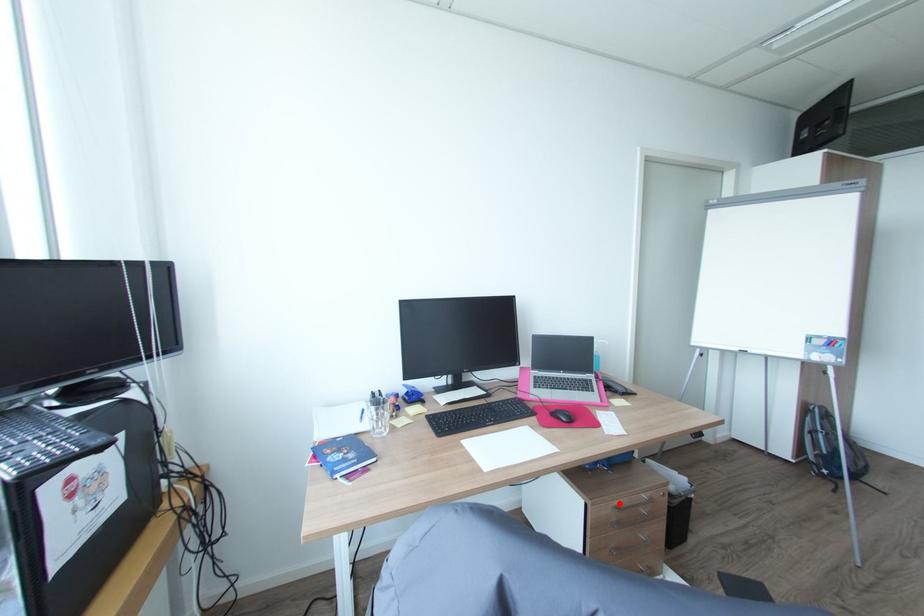
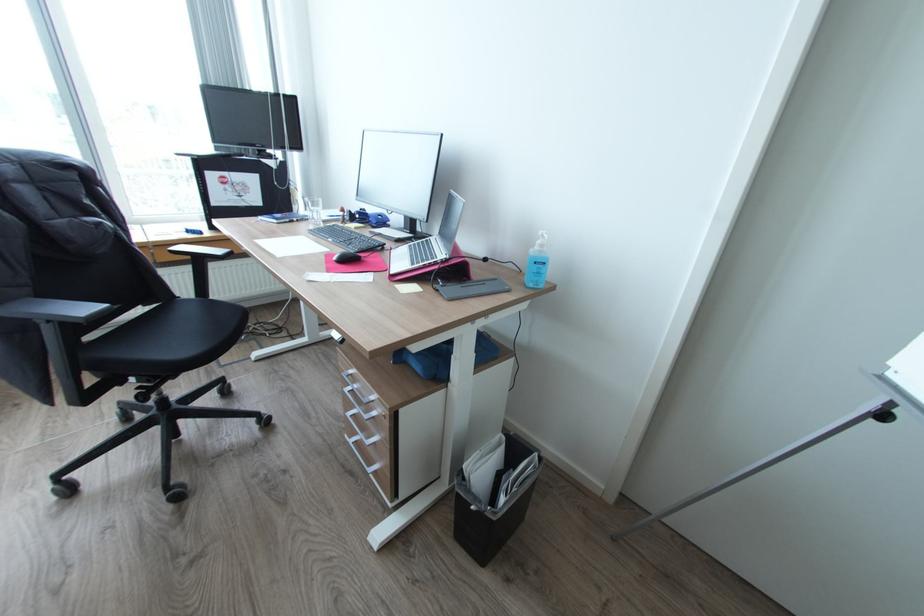
Locate, in the second image, the point that corresponds to the highlighted location in the first image.

(357, 371)